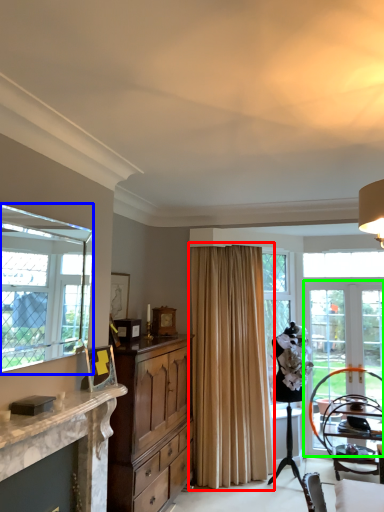
Question: Which is nearer to the curtain (highlighted by a red box)? window (highlighted by a blue box) or screen door (highlighted by a green box).

Choices:
 (A) window
 (B) screen door

Answer: (B)